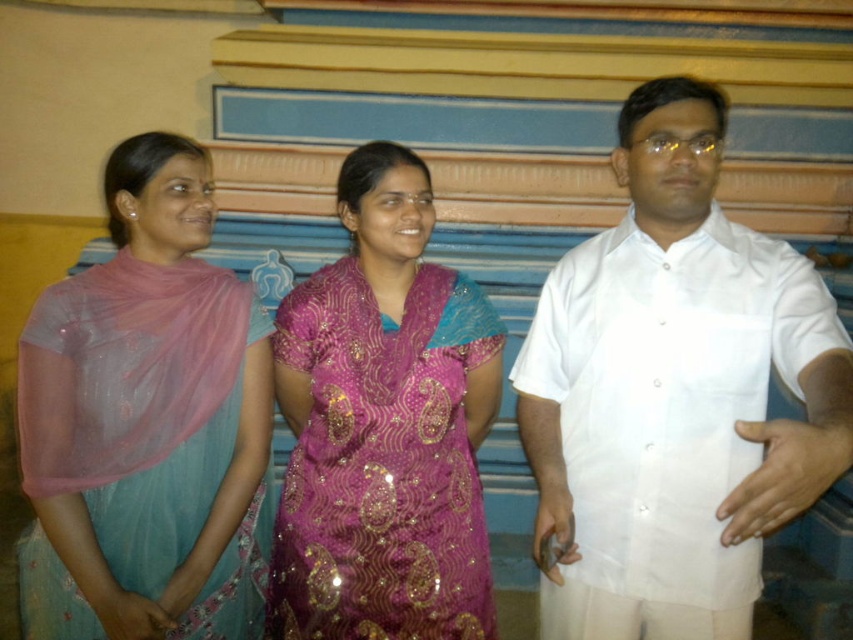
You are a photographer setting up for a group photo. You notice the white linen shirt at right and the purple sequined dress at center. Which clothing item is positioned higher in the image?

The white linen shirt at right is above the purple sequined dress at center, so the white linen shirt at right is positioned higher in the image.

You are a photographer setting up for a group photo. You want to ensure that both the light blue silk saree at left and the purple sequined dress at center are clearly visible in the shot. Given their positions, which one might require more careful lighting adjustments to avoid being overshadowed?

The purple sequined dress at center is further away from the viewer than the light blue silk saree at left, so it might require more careful lighting adjustments to avoid being overshadowed.